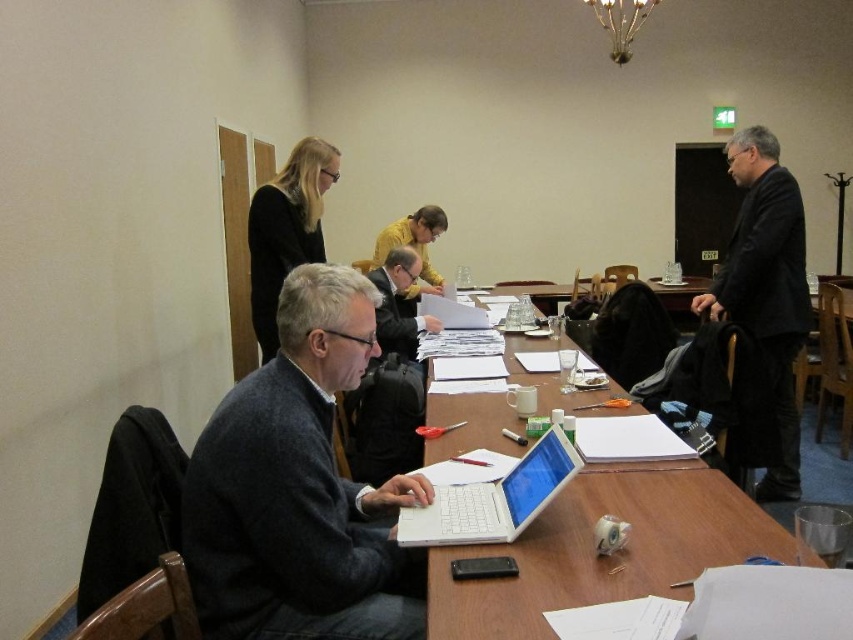
Question: Does black matte sweater at upper center appear over dark gray sweater at center?

Choices:
 (A) no
 (B) yes

Answer: (B)

Question: Is gray wool sweater at center closer to the viewer compared to white glossy table at center?

Choices:
 (A) no
 (B) yes

Answer: (A)

Question: Among these objects, which one is farthest from the camera?

Choices:
 (A) black matte sweater at upper center
 (B) white plastic laptop at center
 (C) white glossy table at center
 (D) black wool coat at right

Answer: (A)

Question: Which is farther from the white glossy table at center?

Choices:
 (A) black wool coat at right
 (B) white plastic laptop at center
 (C) black matte sweater at upper center
 (D) yellow sweater at center

Answer: (D)

Question: Is white glossy table at center positioned behind dark gray sweater at center?

Choices:
 (A) no
 (B) yes

Answer: (A)

Question: Estimate the real-world distances between objects in this image. Which object is closer to the white glossy table at center?

Choices:
 (A) black matte sweater at upper center
 (B) white plastic laptop at center

Answer: (B)